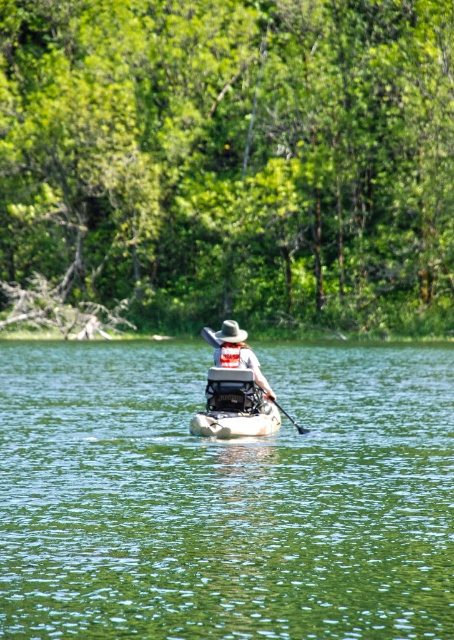
Is green leafy trees at upper center bigger than matte khaki hat at center?

Yes.

Who is more distant from viewer, (169, 192) or (248, 365)?

The point (169, 192) is behind.

You are a GUI agent. You are given a task and a screenshot of the screen. Output one action in this format:
    pyautogui.click(x=<x>, y=<y>)
    Task: Click on the green leafy trees at upper center
    This screenshot has height=640, width=454.
    Given the screenshot: What is the action you would take?
    pyautogui.click(x=232, y=161)

Between green leafy trees at upper center and white fabric life jacket at center, which one appears on the left side from the viewer's perspective?

From the viewer's perspective, green leafy trees at upper center appears more on the left side.

At what (x,y) coordinates should I click in order to perform the action: click on green leafy trees at upper center. Please return your answer as a coordinate pair (x, y). This screenshot has width=454, height=640. Looking at the image, I should click on (232, 161).

Based on the photo, is green smooth water at center further to camera compared to matte khaki hat at center?

No, it is not.

Is green smooth water at center above matte khaki hat at center?

Actually, green smooth water at center is below matte khaki hat at center.

Identify the location of green smooth water at center. The image size is (454, 640). (225, 496).